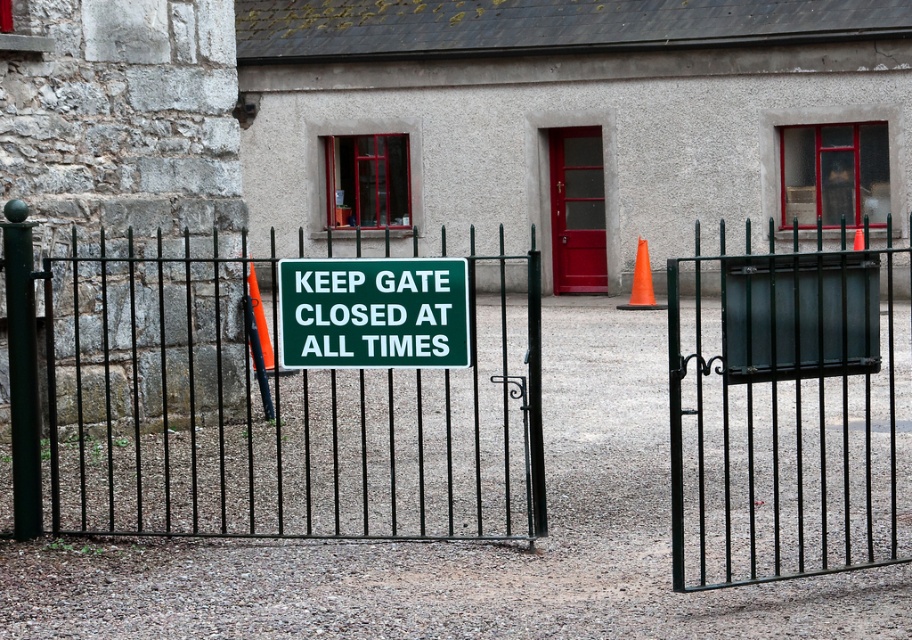
You are a delivery person approaching the building and need to know which object takes up more space in the scene between the green matte sign at center and the orange plastic traffic cone at center. Which one is larger?

The orange plastic traffic cone at center takes up more space in the scene than the green matte sign at center because the green matte sign at center occupies less space than orange plastic traffic cone at center.

You are a delivery person trying to enter through the green wrought iron gate at center and the red glossy door at center. Which entrance is taller?

The green wrought iron gate at center is much taller than the red glossy door at center, so the green wrought iron gate at center is the taller entrance.